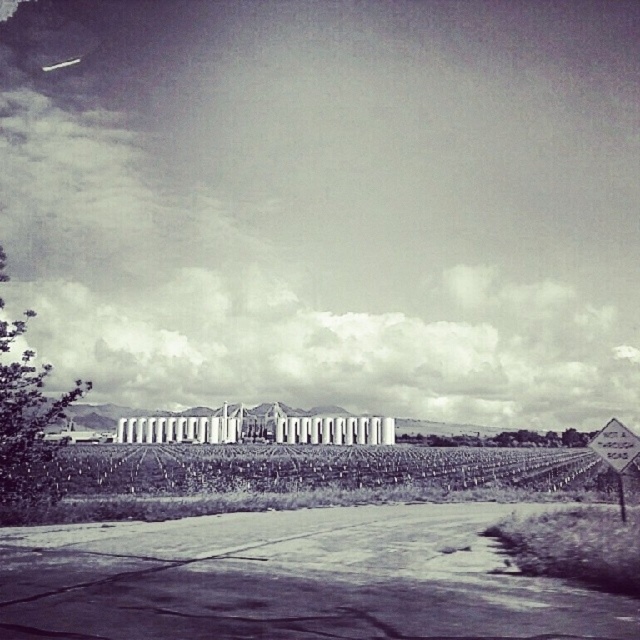
Question: Which point appears closest to the camera in this image?

Choices:
 (A) (138, 484)
 (B) (621, 504)

Answer: (B)

Question: Among these points, which one is farthest from the camera?

Choices:
 (A) (612, 444)
 (B) (476, 490)

Answer: (B)

Question: Can you confirm if green grassy vineyard at center is positioned to the left of metallic diamond-shaped sign at lower right?

Choices:
 (A) no
 (B) yes

Answer: (B)

Question: Is green grassy vineyard at center closer to the viewer compared to metallic diamond-shaped sign at lower right?

Choices:
 (A) no
 (B) yes

Answer: (B)

Question: Does green grassy vineyard at center have a larger size compared to metallic diamond-shaped sign at lower right?

Choices:
 (A) no
 (B) yes

Answer: (B)

Question: Which point is farther to the camera?

Choices:
 (A) (618, 460)
 (B) (156, 461)

Answer: (B)